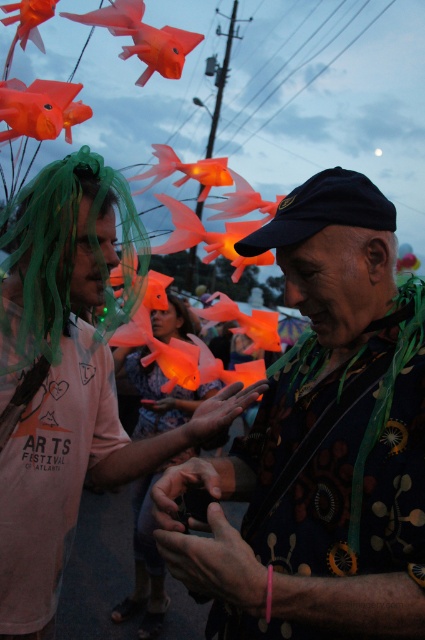
Can you confirm if floral-patterned shirt at center is positioned to the left of matte orange fish at left?

Incorrect, floral-patterned shirt at center is not on the left side of matte orange fish at left.

Does point (385, 595) lie in front of point (125, 198)?

Yes, point (385, 595) is closer to viewer.

Find the location of a particular element. floral-patterned shirt at center is located at coordinates (320, 445).

Can you confirm if floral-patterned shirt at center is positioned above green tulle wig at left?

Actually, floral-patterned shirt at center is below green tulle wig at left.

Can you confirm if floral-patterned shirt at center is smaller than green tulle wig at left?

Actually, floral-patterned shirt at center might be larger than green tulle wig at left.

Which is in front, point (357, 548) or point (73, 202)?

Point (357, 548) is in front.

This screenshot has height=640, width=425. Identify the location of floral-patterned shirt at center. (320, 445).

Can you confirm if matte orange fish at left is positioned below green tulle wig at left?

Yes.

This screenshot has height=640, width=425. What do you see at coordinates (68, 378) in the screenshot?
I see `matte orange fish at left` at bounding box center [68, 378].

Locate an element on the screen. The height and width of the screenshot is (640, 425). matte orange fish at left is located at coordinates (68, 378).